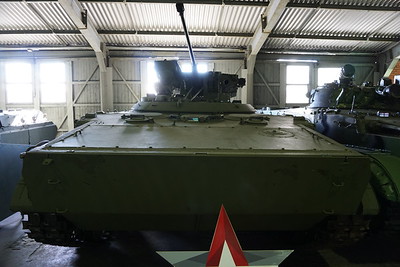
You are a GUI agent. You are given a task and a screenshot of the screen. Output one action in this format:
    pyautogui.click(x=<x>, y=<y>)
    Task: Click on the ceiling tlles
    Image resolution: width=400 pixels, height=267 pixels.
    Given the screenshot: What is the action you would take?
    pyautogui.click(x=24, y=22), pyautogui.click(x=146, y=9), pyautogui.click(x=358, y=20)